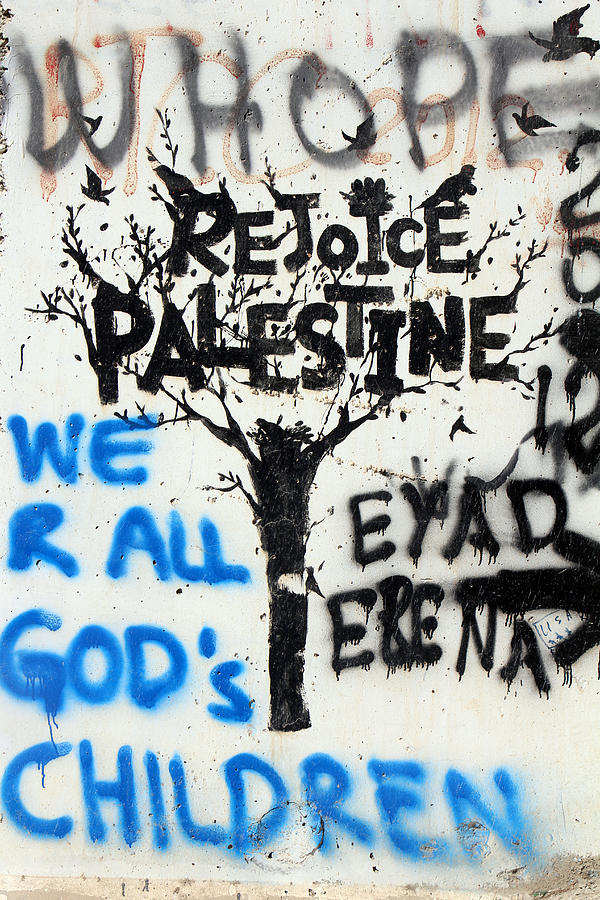
This screenshot has width=600, height=900. I want to click on blue word spray painted on the wall, so click(x=176, y=825), click(x=125, y=671), click(x=142, y=541), click(x=120, y=452).